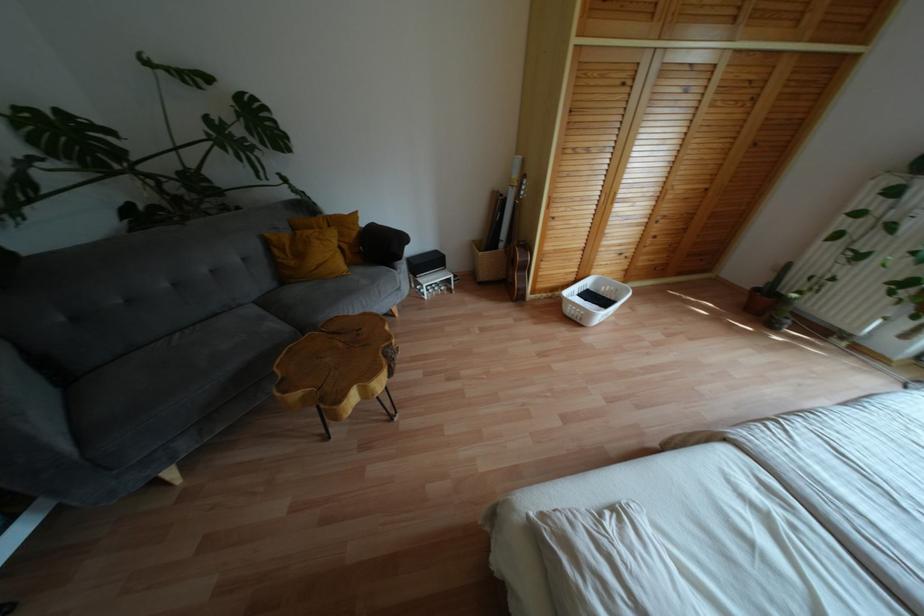
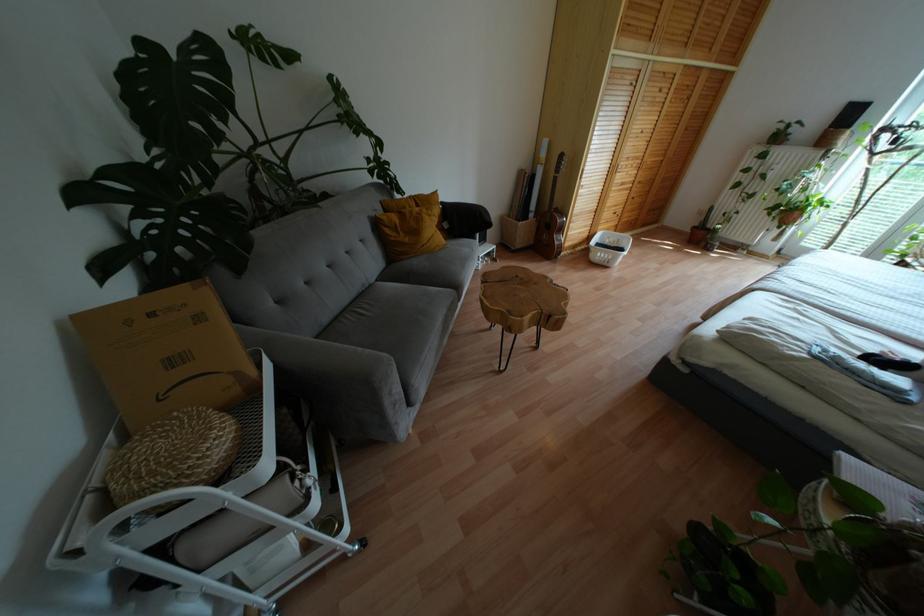
Find the pixel in the second image that matches point (525, 267) in the first image.

(560, 229)